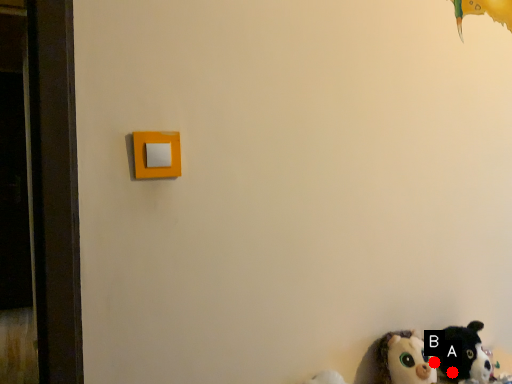
Question: Two points are circled on the image, labeled by A and B beside each circle. Which point is closer to the camera taking this photo?

Choices:
 (A) A is closer
 (B) B is closer

Answer: (B)